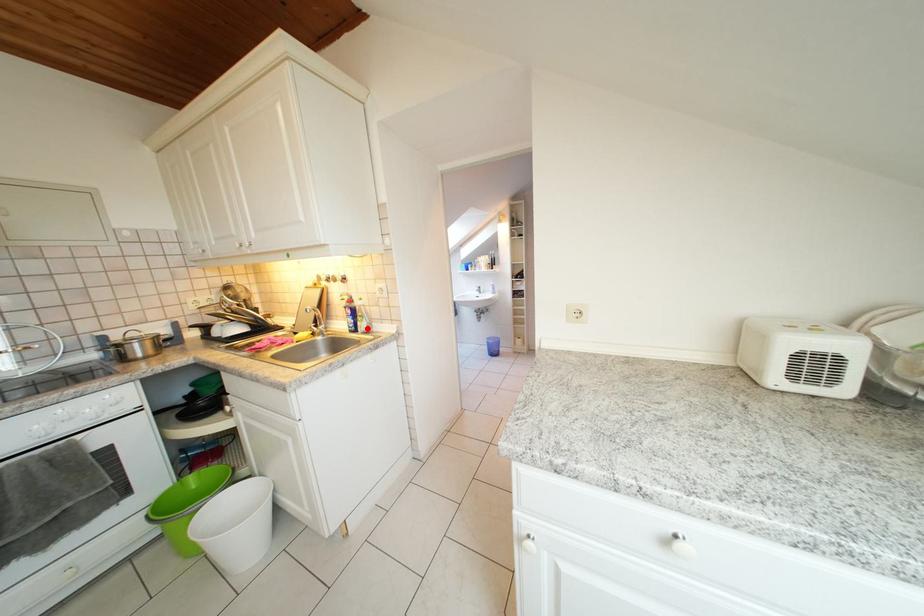
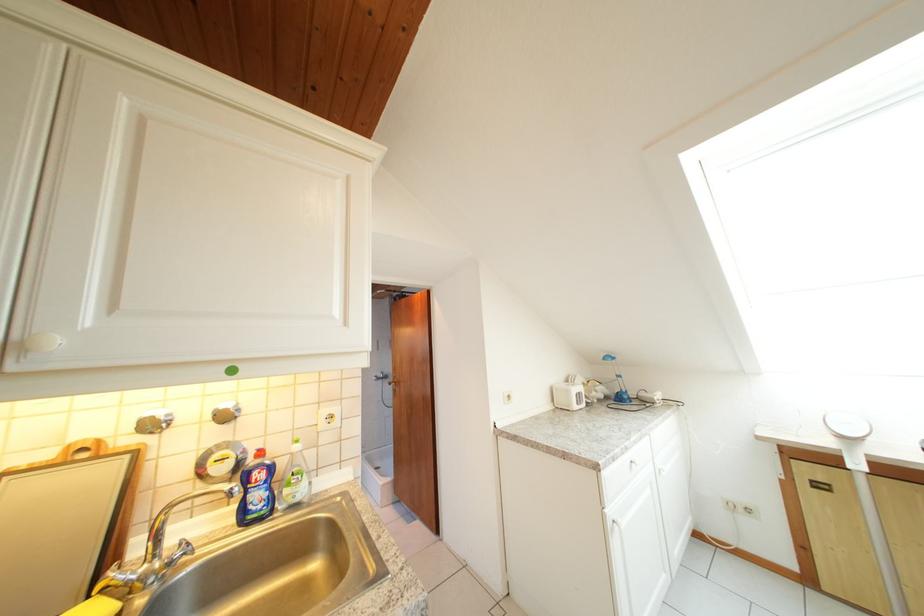
Question: I am providing you with two images of the same scene from different viewpoints. A red point is marked on the first image. At the location where the point appears in image 1, is it still visible in image 2?

Choices:
 (A) Yes
 (B) No

Answer: (A)